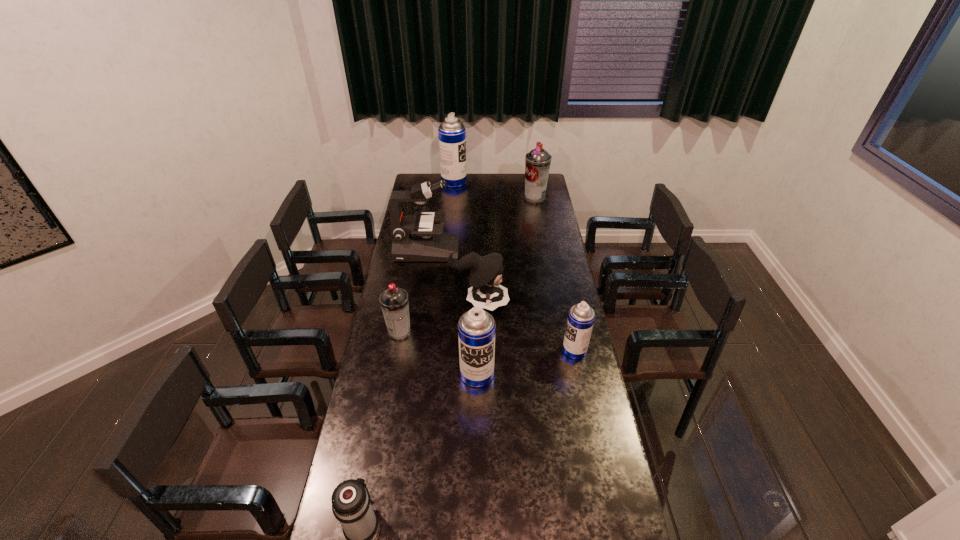
I want to click on free space that is in between the doll and the farthest blue aerosol can, so click(467, 242).

The width and height of the screenshot is (960, 540). What are the coordinates of `free area in between the fourth aerosol can from right to left and the third aerosol can from left to right` in the screenshot? It's located at (466, 278).

Where is `the third closest object to the third farthest object`? the third closest object to the third farthest object is located at coordinates (537, 162).

In order to click on object that is the fifth nearest to the smaller gray aerosol can in this screenshot , I will do `click(351, 504)`.

Identify which aerosol can is the third nearest to the farther gray aerosol can. Please provide its 2D coordinates. Your answer should be formatted as a tuple, i.e. [(x, y)], where the tuple contains the x and y coordinates of a point satisfying the conditions above.

[(394, 302)]

What are the coordinates of `aerosol can that is the second closest to the fourth aerosol can from right to left` in the screenshot? It's located at (394, 302).

Identify the location of the third closest blue aerosol can to the doll. (452, 134).

Find the location of a particular element. blue aerosol can that is the third closest to the doll is located at coordinates (452, 134).

You are a GUI agent. You are given a task and a screenshot of the screen. Output one action in this format:
    pyautogui.click(x=<x>, y=<y>)
    Task: Click on the vacant space that satisfies the following two spatial constraints: 1. on the label side of the rightmost blue aerosol can; 2. on the label side of the second blue aerosol can from right to left
    The image size is (960, 540).
    Given the screenshot: What is the action you would take?
    pos(580,374)